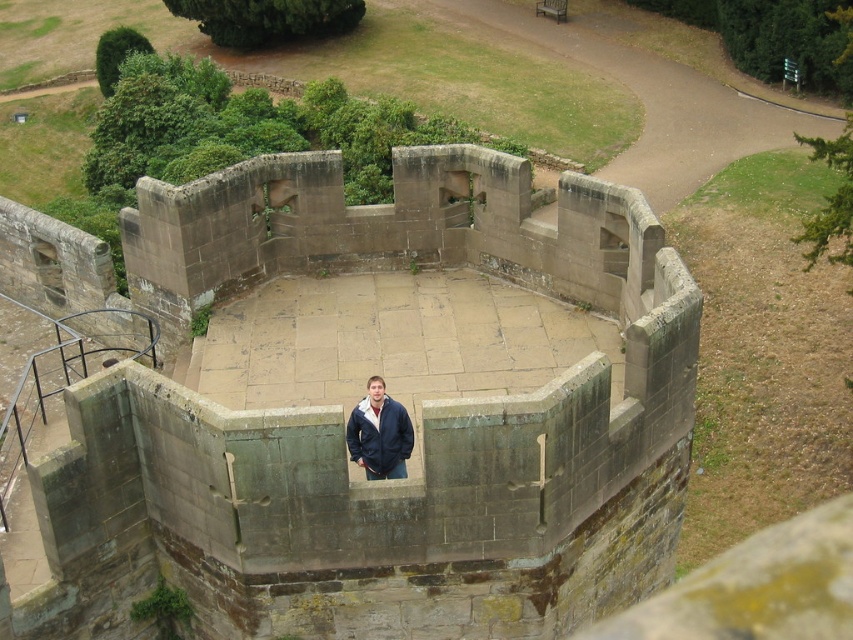
Question: Observing the image, what is the correct spatial positioning of stone wall at center in reference to navy blue jacket at center?

Choices:
 (A) above
 (B) below

Answer: (A)

Question: Is stone wall at center smaller than navy blue jacket at center?

Choices:
 (A) no
 (B) yes

Answer: (A)

Question: Is stone wall at center positioned behind navy blue jacket at center?

Choices:
 (A) yes
 (B) no

Answer: (B)

Question: Which point is farther to the camera?

Choices:
 (A) stone wall at center
 (B) navy blue jacket at center

Answer: (B)

Question: Among these objects, which one is nearest to the camera?

Choices:
 (A) navy blue jacket at center
 (B) stone wall at center

Answer: (B)